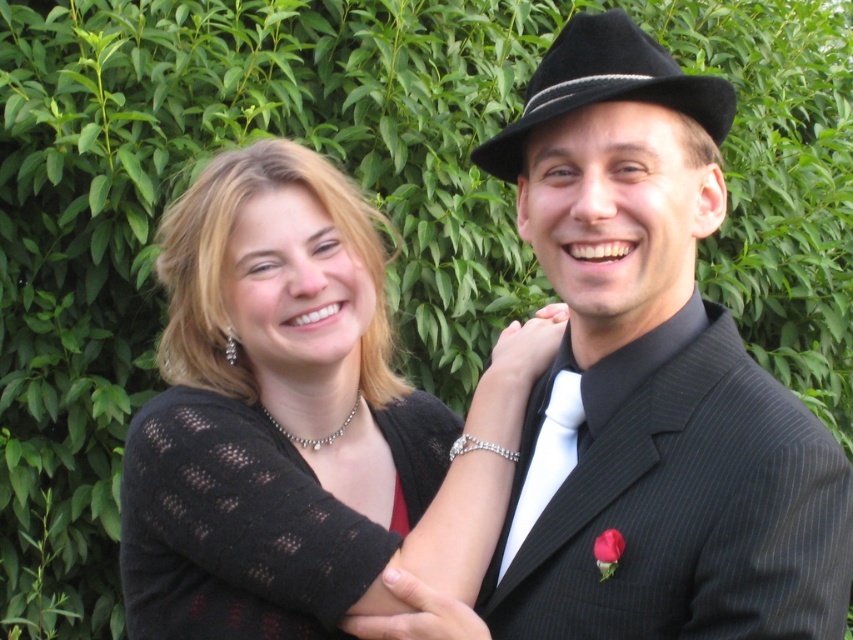
Question: Which of the following is the closest to the observer?

Choices:
 (A) black pinstripe suit at center
 (B) black felt fedora at upper right
 (C) black knitted sweater at center

Answer: (A)

Question: Estimate the real-world distances between objects in this image. Which object is closer to the black felt fedora at upper right?

Choices:
 (A) white satin tie at center
 (B) knitted black sweater at center

Answer: (A)

Question: Is black pinstripe suit at center to the right of black knitted sweater at center from the viewer's perspective?

Choices:
 (A) yes
 (B) no

Answer: (A)

Question: Is black knitted sweater at center positioned at the back of black felt fedora at upper right?

Choices:
 (A) no
 (B) yes

Answer: (B)

Question: Does black felt fedora at upper right appear on the left side of white satin tie at center?

Choices:
 (A) no
 (B) yes

Answer: (A)

Question: Which point is farther to the camera?

Choices:
 (A) (421, 577)
 (B) (576, 285)
 (C) (567, 56)

Answer: (A)